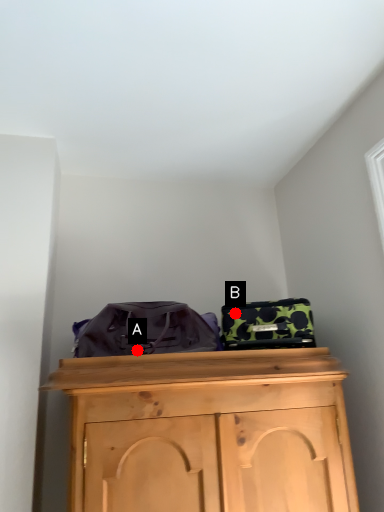
Question: Two points are circled on the image, labeled by A and B beside each circle. Which point is closer to the camera taking this photo?

Choices:
 (A) A is closer
 (B) B is closer

Answer: (A)